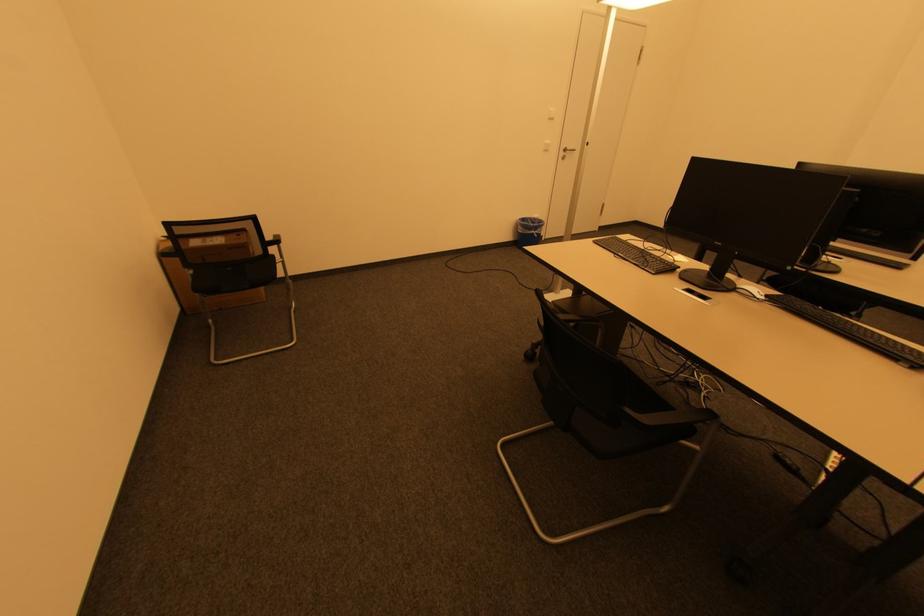
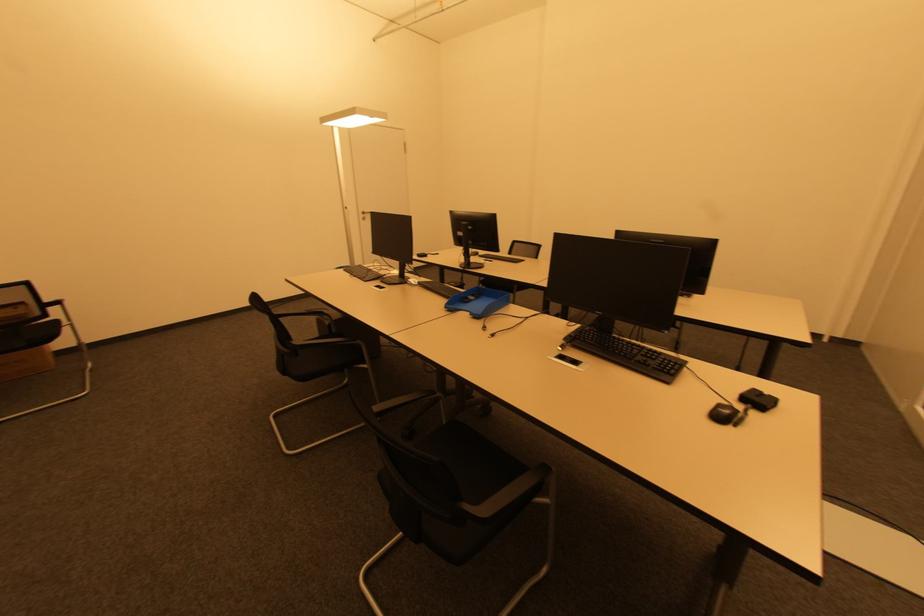
What movement of the cameraman would produce the second image?

The cameraman walked toward right, backward.